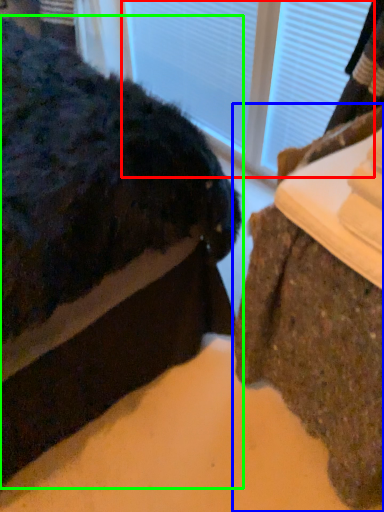
Question: Based on their relative distances, which object is nearer to glass door (highlighted by a red box)? Choose from furniture (highlighted by a blue box) and furniture (highlighted by a green box).

Choices:
 (A) furniture
 (B) furniture

Answer: (B)